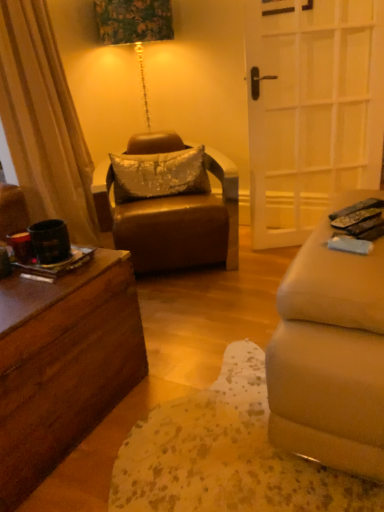
Question: Is leather at center to the left of white glass door at right from the viewer's perspective?

Choices:
 (A) no
 (B) yes

Answer: (B)

Question: From a real-world perspective, is leather at center physically above white glass door at right?

Choices:
 (A) yes
 (B) no

Answer: (B)

Question: Is leather at center to the right of white glass door at right from the viewer's perspective?

Choices:
 (A) yes
 (B) no

Answer: (B)

Question: Is leather at center smaller than white glass door at right?

Choices:
 (A) yes
 (B) no

Answer: (B)

Question: Can you confirm if leather at center is taller than white glass door at right?

Choices:
 (A) yes
 (B) no

Answer: (B)

Question: Are leather at center and white glass door at right far apart?

Choices:
 (A) yes
 (B) no

Answer: (B)

Question: Is the position of white glass door at right more distant than that of black plastic remote control at lower right?

Choices:
 (A) yes
 (B) no

Answer: (A)

Question: Is white glass door at right aimed at black plastic remote control at lower right?

Choices:
 (A) no
 (B) yes

Answer: (B)

Question: Is white glass door at right located outside black plastic remote control at lower right?

Choices:
 (A) no
 (B) yes

Answer: (B)

Question: From the image's perspective, is white glass door at right below black plastic remote control at lower right?

Choices:
 (A) no
 (B) yes

Answer: (A)

Question: Does white glass door at right appear on the left side of black plastic remote control at lower right?

Choices:
 (A) yes
 (B) no

Answer: (B)

Question: Can you confirm if white glass door at right is wider than black plastic remote control at lower right?

Choices:
 (A) no
 (B) yes

Answer: (A)

Question: Does white glass door at right turn towards leather at center?

Choices:
 (A) no
 (B) yes

Answer: (A)